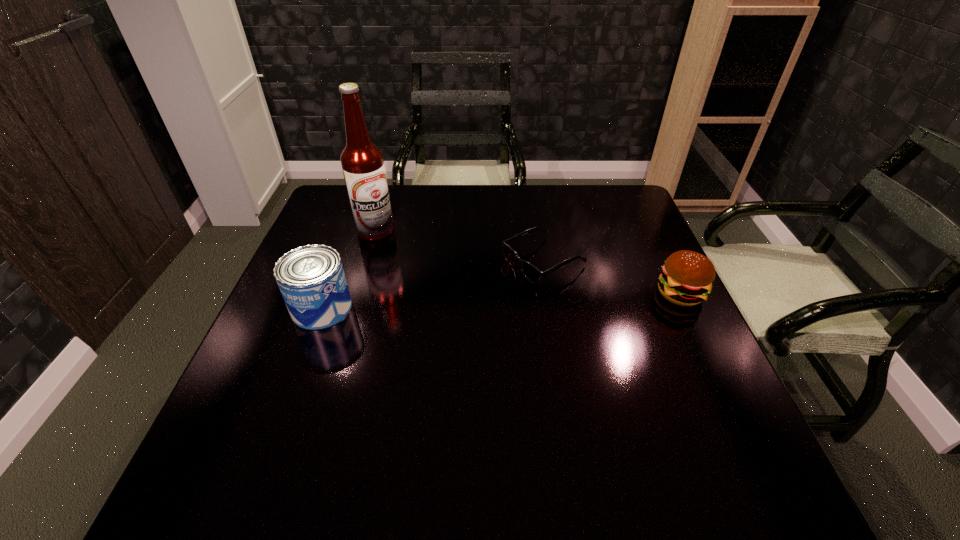
The image size is (960, 540). What are the coordinates of `free space on the desktop that is between the second tallest object and the hamburger and is positioned at the front lenses of the second object from right to left` in the screenshot? It's located at (458, 302).

You are a GUI agent. You are given a task and a screenshot of the screen. Output one action in this format:
    pyautogui.click(x=<x>, y=<y>)
    Task: Click on the vacant space on the desktop that is between the can and the rightmost object and is positioned on the label side of the alcohol
    The height and width of the screenshot is (540, 960).
    Given the screenshot: What is the action you would take?
    pyautogui.click(x=526, y=300)